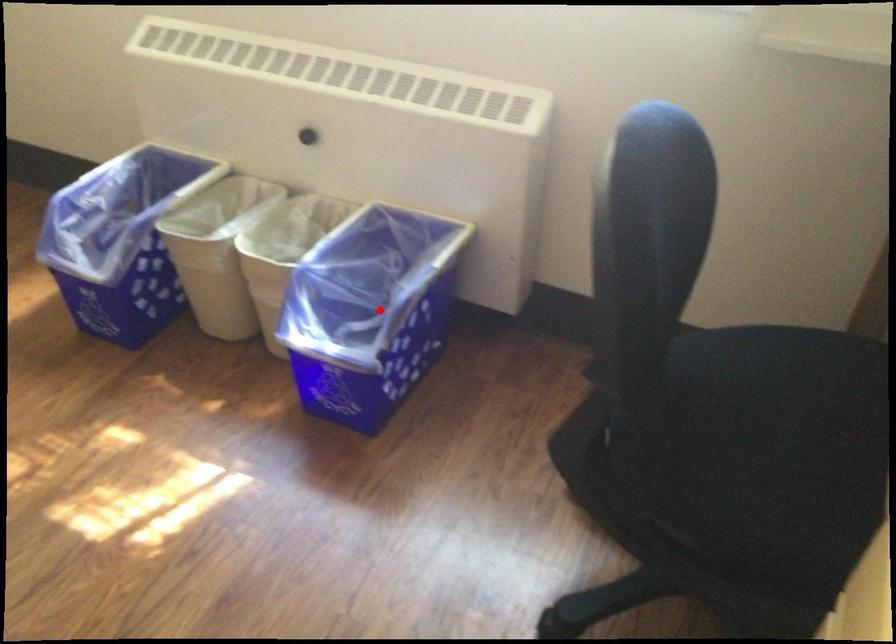
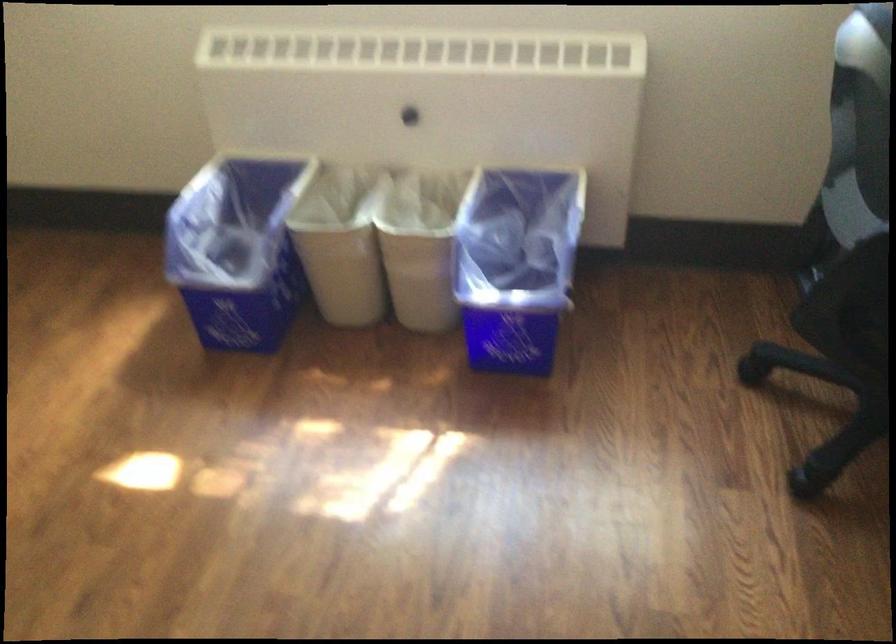
Where in the second image is the point corresponding to the highlighted location from the first image?

(515, 265)